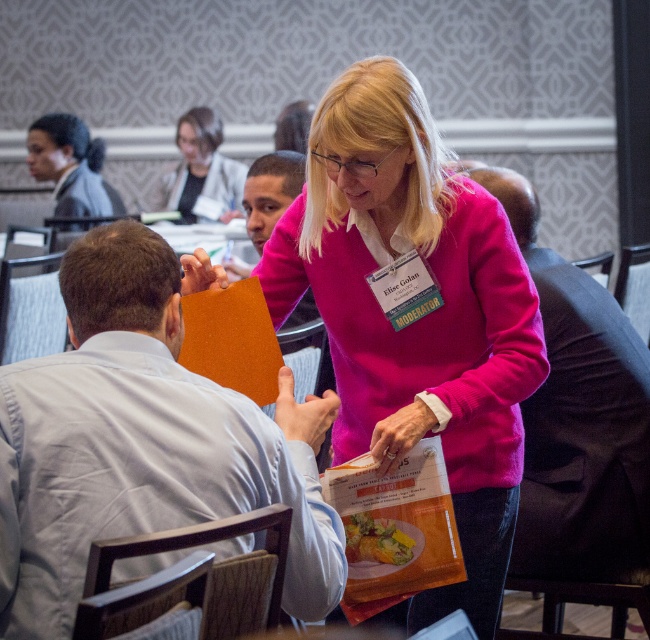
Question: Can you confirm if matte orange folder at center is positioned above matte pink sweater at upper center?

Choices:
 (A) no
 (B) yes

Answer: (A)

Question: Can you confirm if matte black suit at upper left is positioned to the right of matte pink sweater at upper center?

Choices:
 (A) no
 (B) yes

Answer: (A)

Question: Which object is closer to the camera taking this photo?

Choices:
 (A) matte orange folder at center
 (B) pink matte sweater at center

Answer: (A)

Question: Does matte black shirt at center come behind pink matte sweater at center?

Choices:
 (A) no
 (B) yes

Answer: (A)

Question: Among these objects, which one is farthest from the camera?

Choices:
 (A) matte pink sweater at upper center
 (B) matte orange folder at center
 (C) matte black shirt at center
 (D) matte black suit at upper left

Answer: (A)

Question: Estimate the real-world distances between objects in this image. Which object is farther from the matte black shirt at center?

Choices:
 (A) matte pink sweater at upper center
 (B) matte black suit at upper left
 (C) pink sweater at center
 (D) pink matte sweater at center

Answer: (B)